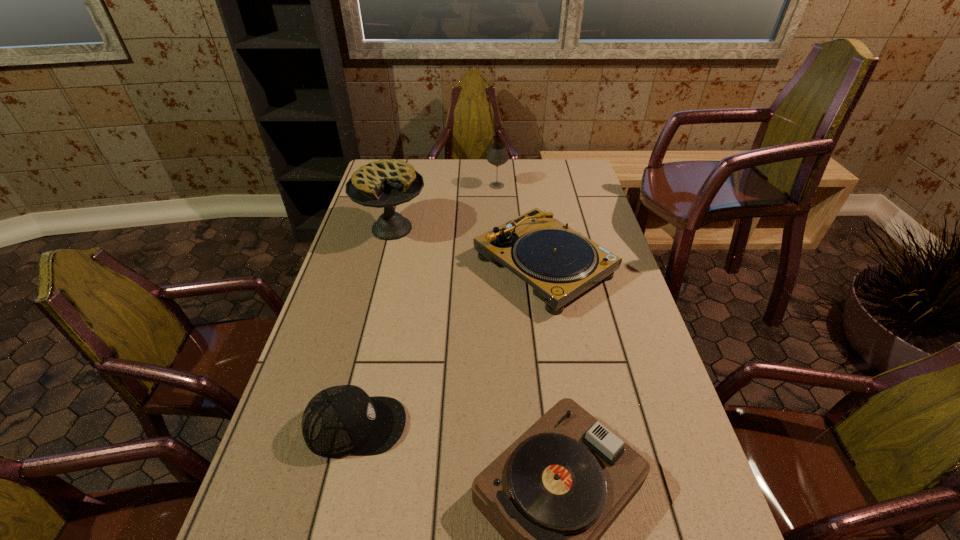
Where is `pie located at the left edge`? Image resolution: width=960 pixels, height=540 pixels. pie located at the left edge is located at coordinates (385, 183).

At what (x,y) coordinates should I click in order to perform the action: click on cap that is at the left edge. Please return your answer as a coordinate pair (x, y). The width and height of the screenshot is (960, 540). Looking at the image, I should click on (338, 421).

This screenshot has height=540, width=960. Find the location of `object that is at the right edge`. object that is at the right edge is located at coordinates (559, 263).

The image size is (960, 540). In the image, there is a desktop. What are the coordinates of `vacant area at the far edge` in the screenshot? It's located at (525, 176).

In the image, there is a desktop. Identify the location of free space at the left edge. (375, 265).

In order to click on free space at the right edge of the desktop in this screenshot , I will do `click(691, 534)`.

Where is `vacant space at the far right corner of the desktop`? The height and width of the screenshot is (540, 960). vacant space at the far right corner of the desktop is located at coordinates (579, 182).

Locate an element on the screen. The image size is (960, 540). free spot between the wineglass and the pie is located at coordinates (444, 207).

Find the location of a particular element. free spot between the cap and the farther record player is located at coordinates (449, 346).

You are a GUI agent. You are given a task and a screenshot of the screen. Output one action in this format:
    pyautogui.click(x=<x>, y=<y>)
    Task: Click on the free space between the pie and the farther record player
    
    Given the screenshot: What is the action you would take?
    pyautogui.click(x=468, y=247)